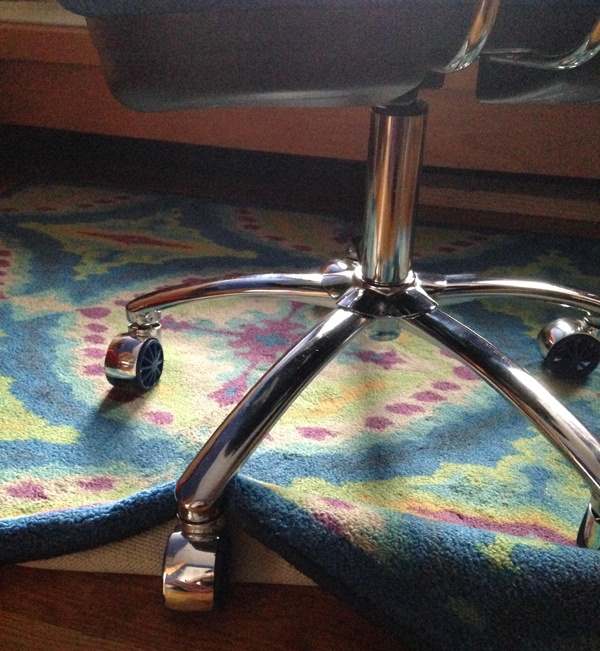
At what (x,y) coordinates should I click in order to perform the action: click on metal chair legs. Please return your answer as a coordinate pair (x, y). Image resolution: width=600 pixels, height=651 pixels. Looking at the image, I should click on (448, 331), (339, 333), (301, 282), (460, 282), (348, 266).